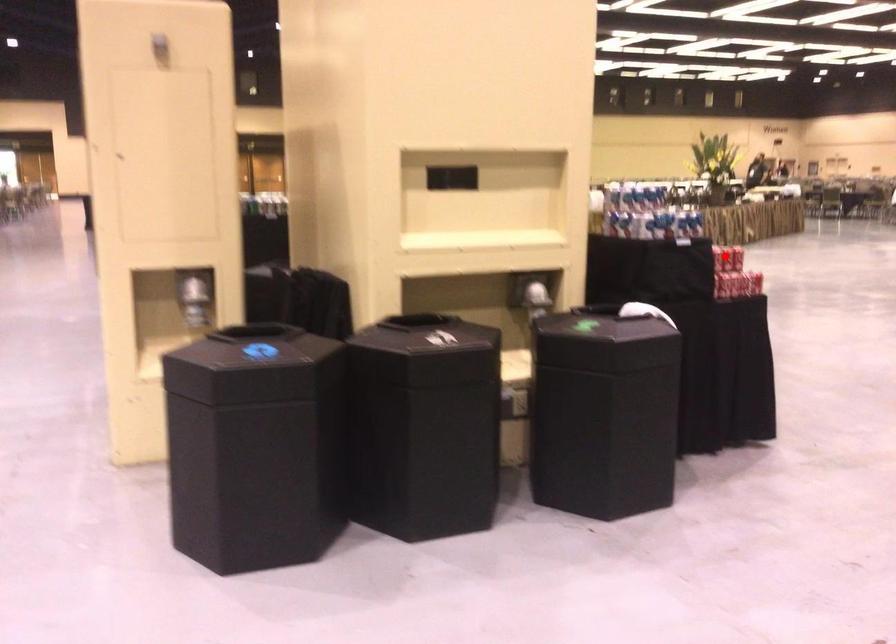
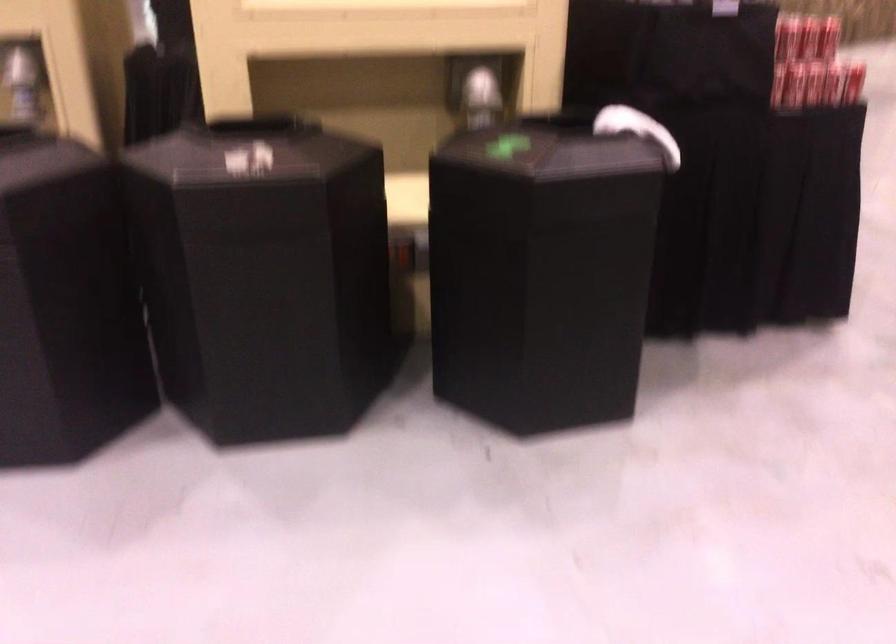
Question: A red point is marked in image1. In image2, is the corresponding 3D point closer to the camera or farther? Reply with the corresponding letter.

Choices:
 (A) The corresponding 3D point is closer.
 (B) The corresponding 3D point is farther.

Answer: (A)